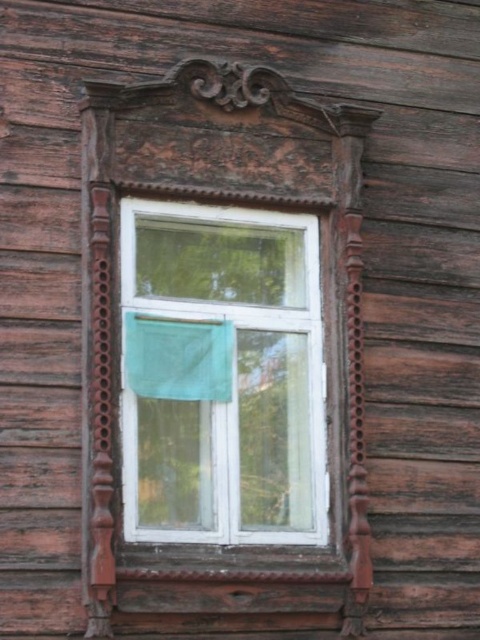
You are looking at the wooden window frame and notice two points marked on it. The first point is at coordinates point [315,308] and the second is at point [182,388]. Which of these points is closer to you?

Point [315,308] is further to the camera than point [182,388], so the point closer to you is point [182,388].

You are standing in a room and see the white wood window at center and the green fabric at center. Which object is closer to you?

The white wood window at center is closer to you because it is in front of the green fabric at center.

You are an interior designer assessing the space in front of the white wood window at center and the green fabric at center. Which object occupies more horizontal space?

The white wood window at center has a larger width than the green fabric at center, so it occupies more horizontal space.